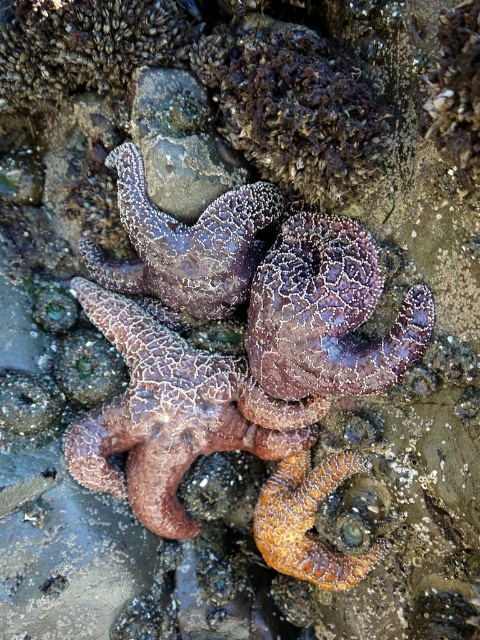
Is purple rough starfish at center above orange textured starfish at center?

Yes.

Does point (182, 259) lie in front of point (348, 557)?

Yes, it is in front of point (348, 557).

Identify the location of purple rough starfish at center. (186, 243).

Looking at this image, which is above, textured purple starfish at center or purple rough starfish at center?

purple rough starfish at center

Looking at this image, does textured purple starfish at center have a smaller size compared to purple rough starfish at center?

Incorrect, textured purple starfish at center is not smaller in size than purple rough starfish at center.

Is point (105, 449) more distant than point (136, 216)?

That is True.

This screenshot has width=480, height=640. Identify the location of textured purple starfish at center. (173, 413).

Who is higher up, rusty textured starfish at center or orange textured starfish at center?

Positioned higher is rusty textured starfish at center.

Which is more to the right, rusty textured starfish at center or orange textured starfish at center?

Positioned to the right is orange textured starfish at center.

You are a GUI agent. You are given a task and a screenshot of the screen. Output one action in this format:
    pyautogui.click(x=<x>, y=<y>)
    Task: Click on the rusty textured starfish at center
    This screenshot has height=640, width=480.
    Given the screenshot: What is the action you would take?
    pyautogui.click(x=326, y=314)